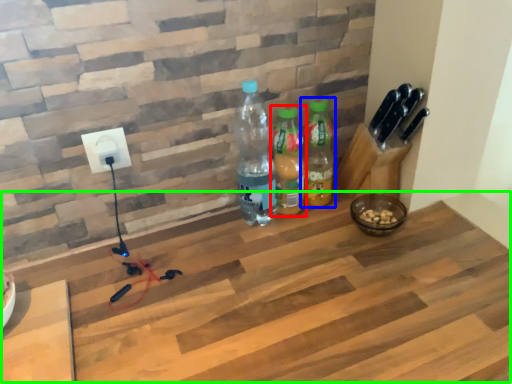
Question: Estimate the real-world distances between objects in this image. Which object is closer to bottle (highlighted by a red box), bottle (highlighted by a blue box) or workbench (highlighted by a green box)?

Choices:
 (A) bottle
 (B) workbench

Answer: (A)